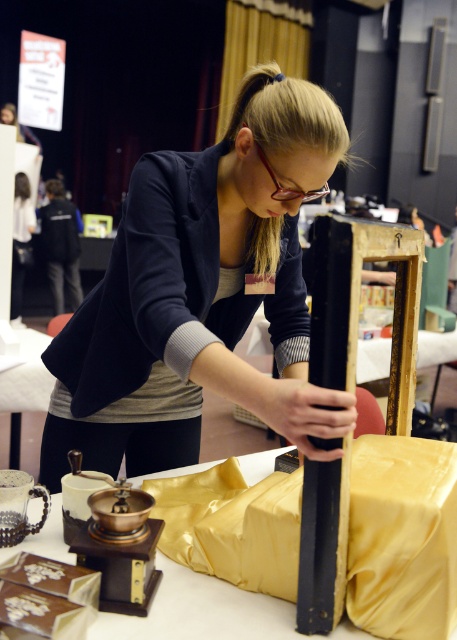
You are planning to place a decorative vase on the gold satin table at lower center. Considering the size of the matte black pole at center, will the vase fit on the table?

The matte black pole at center is larger than the gold satin table at lower center, so the vase may not fit properly due to the table being smaller in size compared to the pole.

You are setting up a booth for an event and need to decide which object to place on a narrow shelf that can only hold items up to 5 cm in width. Based on the scene, which object between the matte black pole at center and the gold satin table at lower center would you choose?

The matte black pole at center is thinner than the gold satin table at lower center, so it would fit better on the narrow shelf that can only hold items up to 5 cm in width.

Consider the image. You are standing at the entrance of the exhibition booth and want to reach the gold satin table at lower center to pick up a brochure. There is a matte black pole at center blocking your path. Can you walk around the pole to reach the table?

The gold satin table at lower center is behind the matte black pole at center, so you can walk around the pole to access the table.